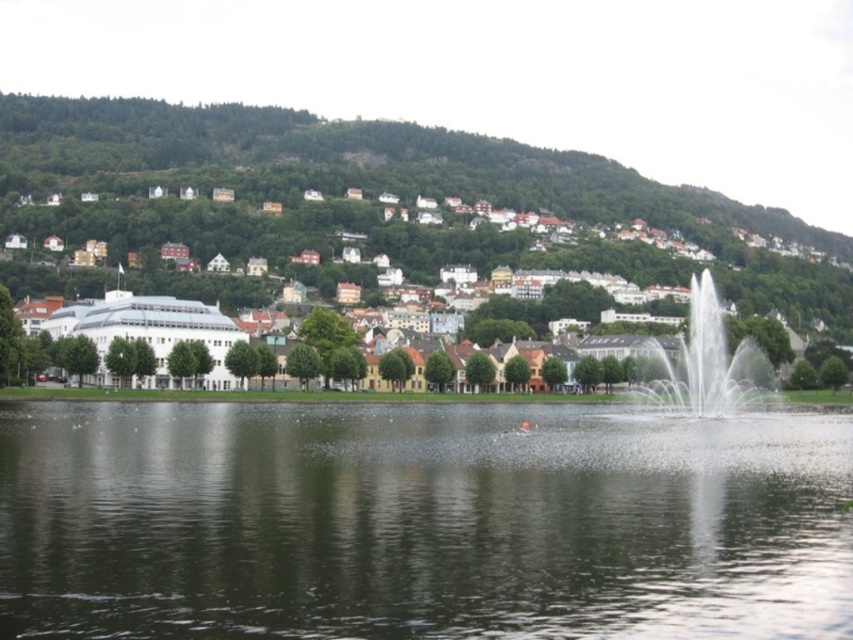
What do you see at coordinates (421, 522) in the screenshot? The height and width of the screenshot is (640, 853). I see `clear water at center` at bounding box center [421, 522].

Is point (816, 500) positioned after point (146, 115)?

That is False.

Which is behind, point (686, 580) or point (775, 218)?

Point (775, 218)

Find the location of a particular element. clear water at center is located at coordinates (421, 522).

Can you confirm if clear water at center is smaller than white frothy water at right?

Yes.

Who is more distant from viewer, (560, 474) or (721, 353)?

Positioned behind is point (721, 353).

Is point (135, 456) closer to viewer compared to point (639, 397)?

That is True.

The width and height of the screenshot is (853, 640). What are the coordinates of `clear water at center` in the screenshot? It's located at (421, 522).

Which is more to the left, green grassy hillside at upper left or white frothy water at right?

From the viewer's perspective, green grassy hillside at upper left appears more on the left side.

Is point (57, 128) positioned behind point (666, 396)?

Yes, point (57, 128) is behind point (666, 396).

Locate an element on the screen. green grassy hillside at upper left is located at coordinates pos(350,163).

The image size is (853, 640). Identify the location of green grassy hillside at upper left. (350, 163).